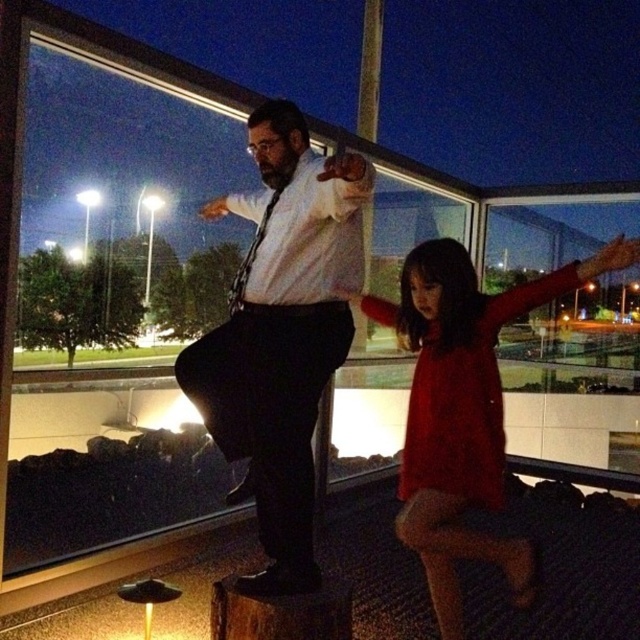
Does matte white shirt at center appear under matte red dress at center?

Actually, matte white shirt at center is above matte red dress at center.

Describe the element at coordinates (282, 333) in the screenshot. The image size is (640, 640). I see `matte white shirt at center` at that location.

The height and width of the screenshot is (640, 640). Identify the location of matte white shirt at center. (282, 333).